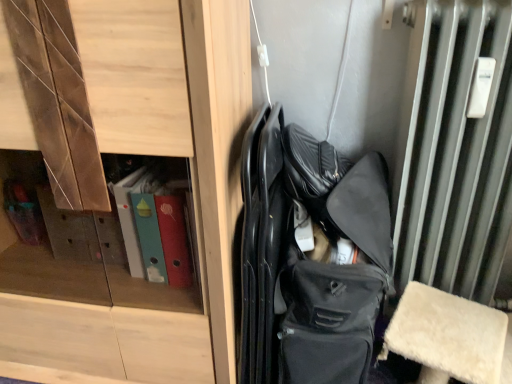
The image size is (512, 384). What do you see at coordinates (310, 257) in the screenshot? I see `matte black bag at center` at bounding box center [310, 257].

At what (x,y) coordinates should I click in order to perform the action: click on matte black bag at center. Please return your answer as a coordinate pair (x, y). Looking at the image, I should click on (310, 257).

Describe the element at coordinates (138, 154) in the screenshot. This screenshot has height=384, width=512. I see `wooden cabinet at center` at that location.

What is the approximate height of wooden cabinet at center?

wooden cabinet at center is 1.17 meters in height.

The width and height of the screenshot is (512, 384). In order to click on wooden cabinet at center in this screenshot , I will do `click(138, 154)`.

I want to click on matte black bag at center, so click(310, 257).

Which object is positioned more to the right, wooden cabinet at center or matte black bag at center?

From the viewer's perspective, matte black bag at center appears more on the right side.

Between wooden cabinet at center and matte black bag at center, which one is positioned behind?

matte black bag at center is behind.

Does point (182, 112) lie behind point (313, 297)?

No, (182, 112) is in front of (313, 297).

From the image's perspective, is wooden cabinet at center on top of matte black bag at center?

Yes, from the image's perspective, wooden cabinet at center is on top of matte black bag at center.

From a real-world perspective, which object stands above the other?

wooden cabinet at center.

Can you confirm if wooden cabinet at center is wider than matte black bag at center?

Indeed, wooden cabinet at center has a greater width compared to matte black bag at center.

Considering the sizes of wooden cabinet at center and matte black bag at center in the image, is wooden cabinet at center taller or shorter than matte black bag at center?

wooden cabinet at center is taller than matte black bag at center.

Which of these two, wooden cabinet at center or matte black bag at center, is smaller?

With smaller size is matte black bag at center.

Is wooden cabinet at center surrounding matte black bag at center?

No, matte black bag at center is not surrounded by wooden cabinet at center.

Is wooden cabinet at center far away from matte black bag at center?

Actually, wooden cabinet at center and matte black bag at center are a little close together.

Consider the image. Is wooden cabinet at center aimed at matte black bag at center?

No, wooden cabinet at center is not oriented towards matte black bag at center.

From the picture: What's the angular difference between wooden cabinet at center and matte black bag at center's facing directions?

The angle between the facing direction of wooden cabinet at center and the facing direction of matte black bag at center is 0.281 degrees.

Image resolution: width=512 pixels, height=384 pixels. I want to click on cabinetry that appears above the matte black bag at center (from a real-world perspective), so click(x=138, y=154).

Does matte black bag at center appear on the left side of wooden cabinet at center?

Incorrect, matte black bag at center is not on the left side of wooden cabinet at center.

Does matte black bag at center lie in front of wooden cabinet at center?

No, the depth of matte black bag at center is greater than that of wooden cabinet at center.

Considering the positions of point (334, 326) and point (163, 79), is point (334, 326) closer or farther from the camera than point (163, 79)?

Clearly, point (334, 326) is more distant from the camera than point (163, 79).

From the image's perspective, who appears lower, matte black bag at center or wooden cabinet at center?

matte black bag at center appears lower in the image.

From a real-world perspective, is matte black bag at center positioned above or below wooden cabinet at center?

In terms of real-world spatial position, matte black bag at center is below wooden cabinet at center.

Is matte black bag at center wider than wooden cabinet at center?

No.

Considering the sizes of matte black bag at center and wooden cabinet at center in the image, is matte black bag at center taller or shorter than wooden cabinet at center?

matte black bag at center is shorter than wooden cabinet at center.

Who is smaller, matte black bag at center or wooden cabinet at center?

matte black bag at center.

Do you think matte black bag at center is within wooden cabinet at center, or outside of it?

The correct answer is: outside.

Is matte black bag at center not close to wooden cabinet at center?

Actually, matte black bag at center and wooden cabinet at center are a little close together.

Could you tell me if matte black bag at center is turned towards wooden cabinet at center?

No, matte black bag at center is not turned towards wooden cabinet at center.

Find the location of a particular element. This screenshot has height=384, width=512. bag directly beneath the wooden cabinet at center (from a real-world perspective) is located at coordinates (310, 257).

What are the coordinates of `cabinetry that appears in front of the matte black bag at center` in the screenshot? It's located at (138, 154).

This screenshot has height=384, width=512. Identify the location of bag that appears below the wooden cabinet at center (from a real-world perspective). (310, 257).